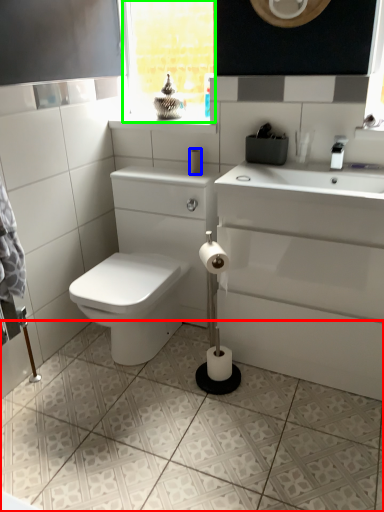
Question: Which is farther away from ceramic tile (highlighted by a red box)? toilet paper (highlighted by a blue box) or window frame (highlighted by a green box)?

Choices:
 (A) toilet paper
 (B) window frame

Answer: (B)